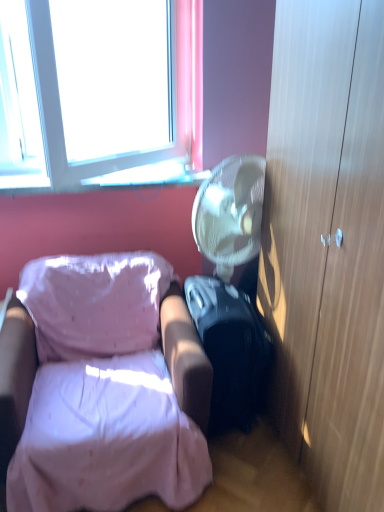
Question: Is the depth of black matte suitcase at lower right greater than that of pink fabric chair at lower left?

Choices:
 (A) yes
 (B) no

Answer: (A)

Question: Does black matte suitcase at lower right appear on the right side of pink fabric chair at lower left?

Choices:
 (A) no
 (B) yes

Answer: (B)

Question: From a real-world perspective, is black matte suitcase at lower right positioned over pink fabric chair at lower left based on gravity?

Choices:
 (A) yes
 (B) no

Answer: (B)

Question: Could you tell me if black matte suitcase at lower right is turned towards pink fabric chair at lower left?

Choices:
 (A) yes
 (B) no

Answer: (B)

Question: Is the depth of black matte suitcase at lower right less than that of pink fabric chair at lower left?

Choices:
 (A) yes
 (B) no

Answer: (B)

Question: From a real-world perspective, relative to pink fabric chair at lower left, is transparent glass window sill at upper left vertically above or below?

Choices:
 (A) above
 (B) below

Answer: (A)

Question: Visually, is transparent glass window sill at upper left positioned to the left or to the right of pink fabric chair at lower left?

Choices:
 (A) left
 (B) right

Answer: (A)

Question: Would you say transparent glass window sill at upper left is inside or outside pink fabric chair at lower left?

Choices:
 (A) inside
 (B) outside

Answer: (B)

Question: Is transparent glass window sill at upper left taller or shorter than pink fabric chair at lower left?

Choices:
 (A) tall
 (B) short

Answer: (B)

Question: Would you say wooden cabinet at right is inside or outside transparent glass window sill at upper left?

Choices:
 (A) outside
 (B) inside

Answer: (A)

Question: From a real-world perspective, is wooden cabinet at right physically located above or below transparent glass window sill at upper left?

Choices:
 (A) below
 (B) above

Answer: (A)

Question: In terms of height, does wooden cabinet at right look taller or shorter compared to transparent glass window sill at upper left?

Choices:
 (A) tall
 (B) short

Answer: (A)

Question: Is wooden cabinet at right to the left or to the right of transparent glass window sill at upper left in the image?

Choices:
 (A) left
 (B) right

Answer: (B)

Question: In terms of width, does transparent glass window sill at upper left look wider or thinner when compared to wooden cabinet at right?

Choices:
 (A) wide
 (B) thin

Answer: (B)

Question: Does point (165, 166) appear closer or farther from the camera than point (291, 233)?

Choices:
 (A) closer
 (B) farther

Answer: (B)